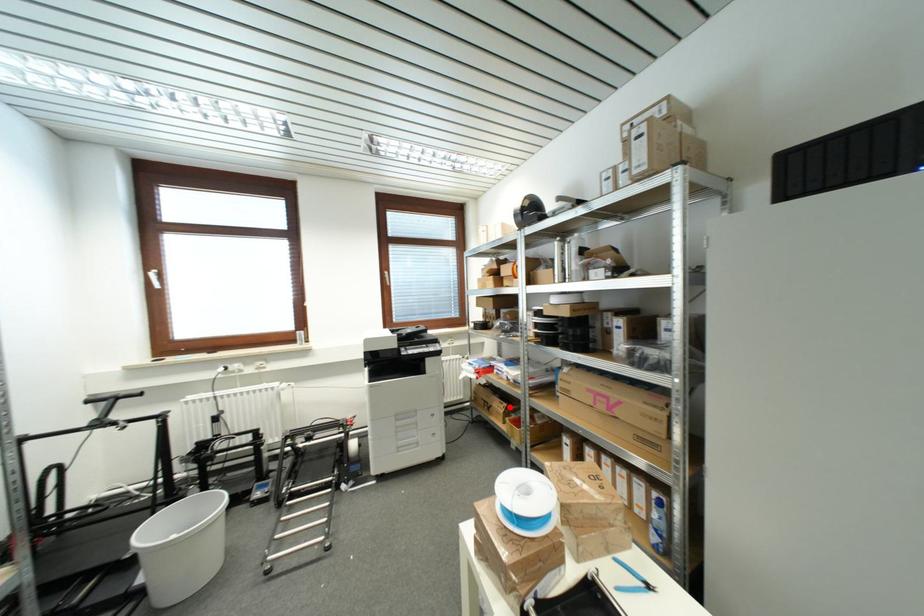
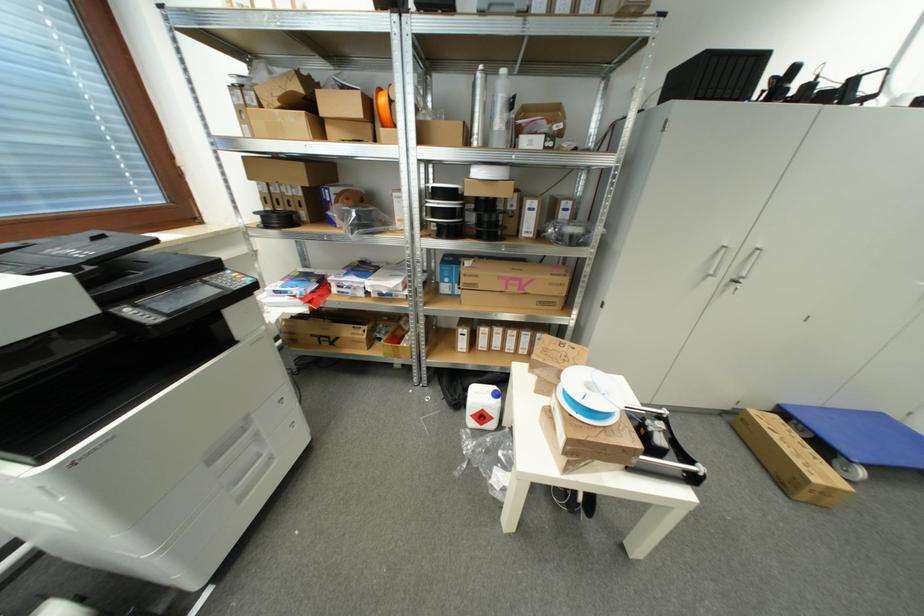
Question: I am providing you with two images of the same scene from different viewpoints. Given a red point in image1, look at the same physical point in image2. Is it:

Choices:
 (A) Closer to the viewpoint
 (B) Farther from the viewpoint

Answer: (A)